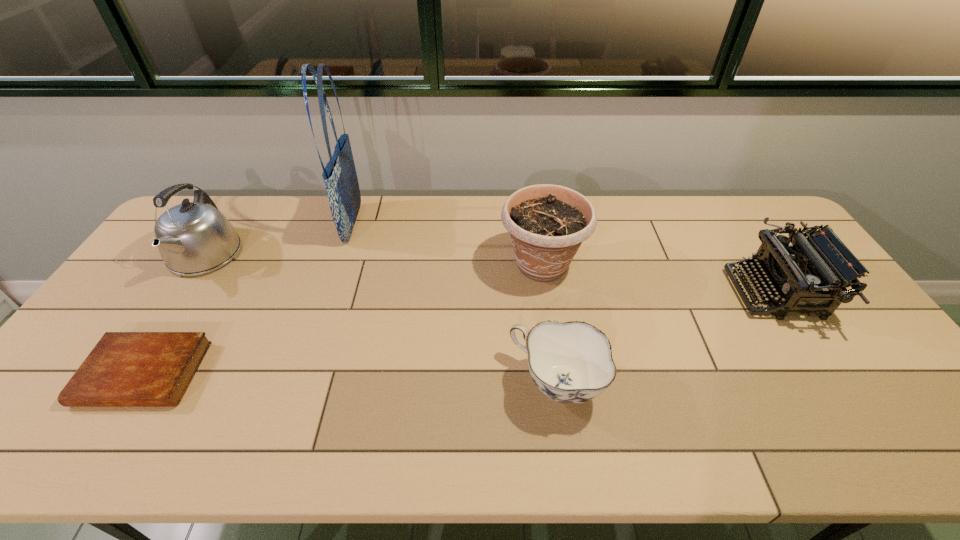
The width and height of the screenshot is (960, 540). Find the location of `Bible at the left edge`. Bible at the left edge is located at coordinates (125, 369).

Find the location of a particular element. The width and height of the screenshot is (960, 540). object located in the right edge section of the desktop is located at coordinates click(x=808, y=278).

I want to click on object that is at the far left corner, so click(x=193, y=238).

In the image, there is a desktop. Identify the location of free space at the far edge. (605, 232).

In order to click on vacant region at the near edge in this screenshot , I will do `click(462, 421)`.

In the image, there is a desktop. Where is `vacant space at the left edge`? vacant space at the left edge is located at coordinates (156, 302).

The width and height of the screenshot is (960, 540). I want to click on vacant space at the right edge of the desktop, so click(923, 403).

Locate an element on the screen. Image resolution: width=960 pixels, height=540 pixels. empty space between the third object from left to right and the Bible is located at coordinates (249, 299).

Image resolution: width=960 pixels, height=540 pixels. Find the location of `empty space that is in between the kettle and the flowerpot`. empty space that is in between the kettle and the flowerpot is located at coordinates (373, 260).

What are the coordinates of `empty space between the flowerpot and the rightmost object` in the screenshot? It's located at (659, 279).